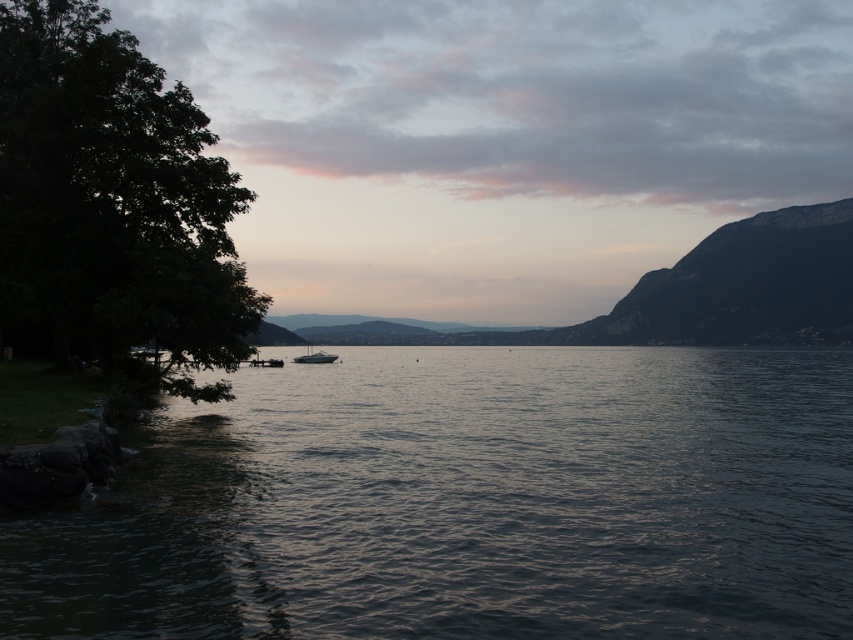
You are standing at the edge of the lake and want to reach the dark water at center. Based on the coordinates provided, in which direction should you move from your current position?

The dark water at center is located at coordinates point (x=468, y=502). Since you are at the edge, you should move towards the center of the lake to reach it.

Consider the image. You are standing on the lakeside and want to take a photo of the dark water at center and the dark green leafy tree at left. Which object will appear closer to the bottom of your photo?

The dark water at center will appear closer to the bottom of your photo because it is shorter than the dark green leafy tree at left.

Looking at this image, you are standing at the lakeside and want to take a photo of the dark green leafy tree at left without the dark water at center appearing in the foreground. Is this possible given their positions?

The dark water at center is closer to the viewer than the dark green leafy tree at left, so you cannot avoid having the dark water at center in the foreground when photographing the dark green leafy tree at left.